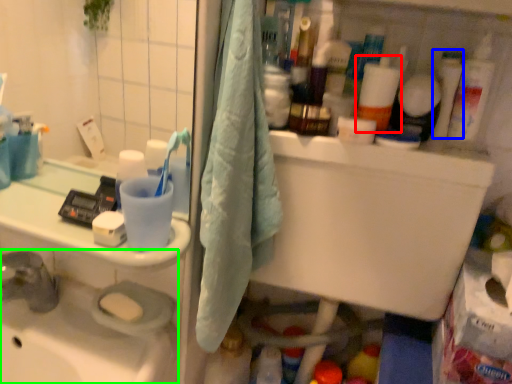
Question: Which object is positioned closest to cleaning product (highlighted by a red box)? Select from toiletry (highlighted by a blue box) and sink (highlighted by a green box).

Choices:
 (A) toiletry
 (B) sink

Answer: (A)